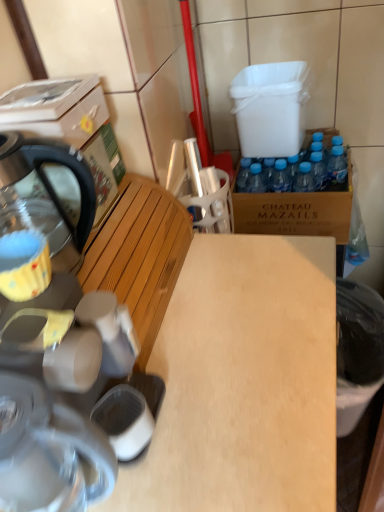
The image size is (384, 512). I want to click on vacant area that is in front of wooden bench at left, so click(212, 400).